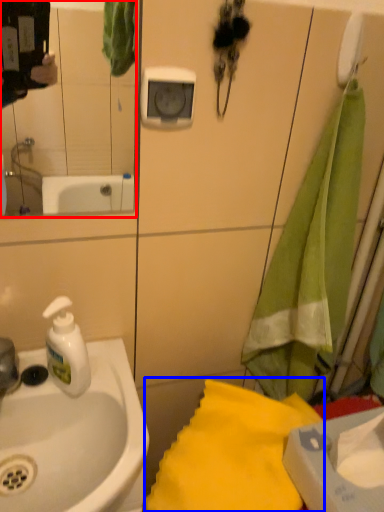
Question: Among these objects, which one is farthest to the camera, mirror (highlighted by a red box) or beach towel (highlighted by a blue box)?

Choices:
 (A) mirror
 (B) beach towel

Answer: (B)